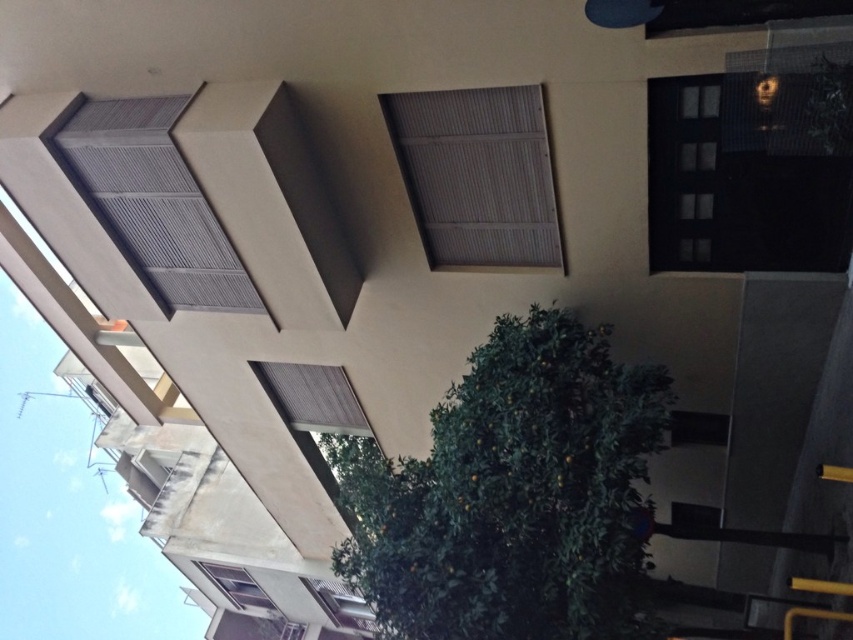
You are a window cleaner with a ladder that can extend up to 25 feet. You need to clean both the matte gray window at center and the matte gray window at lower left. Can you reach both windows with your current ladder without moving it? Explain your reasoning.

The matte gray window at center and the matte gray window at lower left are 28.42 feet apart from each other. Since your ladder can only extend up to 25 feet, you cannot reach both windows without moving the ladder because the distance between them exceeds the ladder length.

You are a maintenance worker needing to reach both the matte gray shutters at center and the gray matte window at upper left. Given that your ladder can extend to 10 feet, can you safely reach both objects with the ladder without moving it?

The distance between the matte gray shutters at center and the gray matte window at upper left is 9.43 feet. Since the ladder can extend to 10 feet, which is longer than the distance between them, you can safely reach both objects without moving the ladder.